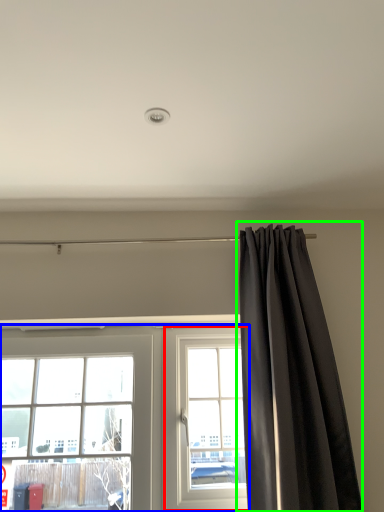
Question: Which is nearer to the window (highlighted by a red box)? window (highlighted by a blue box) or curtain (highlighted by a green box).

Choices:
 (A) window
 (B) curtain

Answer: (A)